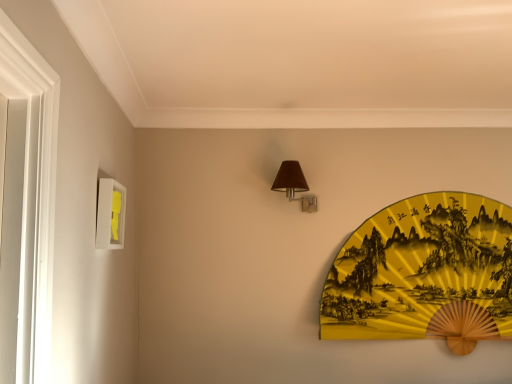
Where is `matte brown fabric at upper center`? This screenshot has height=384, width=512. matte brown fabric at upper center is located at coordinates (294, 185).

What are the coordinates of `yellow paper fan at upper right` in the screenshot? It's located at (421, 268).

Is matte brown fabric at upper center positioned before white matte picture frame at left?

No, the depth of matte brown fabric at upper center is greater than that of white matte picture frame at left.

Find the location of a particular element. The width and height of the screenshot is (512, 384). table lamp that appears on the right of white matte picture frame at left is located at coordinates (294, 185).

From a real-world perspective, which is physically above, matte brown fabric at upper center or white matte picture frame at left?

matte brown fabric at upper center is physically above.

From a real-world perspective, is matte brown fabric at upper center on yellow paper fan at upper right?

Yes, from a real-world perspective, matte brown fabric at upper center is above yellow paper fan at upper right.

Is matte brown fabric at upper center oriented towards yellow paper fan at upper right?

No, matte brown fabric at upper center is not facing towards yellow paper fan at upper right.

Which of these two, matte brown fabric at upper center or yellow paper fan at upper right, stands shorter?

matte brown fabric at upper center is shorter.

From the picture: Is white matte picture frame at left facing away from matte brown fabric at upper center?

No, white matte picture frame at left's orientation is not away from matte brown fabric at upper center.

Do you think white matte picture frame at left is within matte brown fabric at upper center, or outside of it?

white matte picture frame at left lies outside matte brown fabric at upper center.

Considering the relative sizes of white matte picture frame at left and matte brown fabric at upper center in the image provided, is white matte picture frame at left shorter than matte brown fabric at upper center?

No.

How far apart are white matte picture frame at left and matte brown fabric at upper center?

white matte picture frame at left is 90.76 centimeters away from matte brown fabric at upper center.

How much distance is there between yellow paper fan at upper right and matte brown fabric at upper center?

yellow paper fan at upper right and matte brown fabric at upper center are 64.29 centimeters apart.

From their relative heights in the image, would you say yellow paper fan at upper right is taller or shorter than matte brown fabric at upper center?

yellow paper fan at upper right is taller than matte brown fabric at upper center.

From the image's perspective, is yellow paper fan at upper right below matte brown fabric at upper center?

Indeed, from the image's perspective, yellow paper fan at upper right is shown beneath matte brown fabric at upper center.

Which object is further away from the camera taking this photo, yellow paper fan at upper right or matte brown fabric at upper center?

yellow paper fan at upper right is further from the camera.

Who is bigger, white matte picture frame at left or yellow paper fan at upper right?

With larger size is yellow paper fan at upper right.

Is point (113, 247) positioned behind point (396, 230)?

That is False.

From a real-world perspective, who is located lower, white matte picture frame at left or yellow paper fan at upper right?

yellow paper fan at upper right, from a real-world perspective.

This screenshot has width=512, height=384. Find the location of `design behind the white matte picture frame at left`. design behind the white matte picture frame at left is located at coordinates (421, 268).

Considering the positions of objects yellow paper fan at upper right and white matte picture frame at left in the image provided, who is more to the left, yellow paper fan at upper right or white matte picture frame at left?

Positioned to the left is white matte picture frame at left.

Considering the sizes of yellow paper fan at upper right and white matte picture frame at left in the image, is yellow paper fan at upper right wider or thinner than white matte picture frame at left?

In the image, yellow paper fan at upper right appears to be wider than white matte picture frame at left.

Is yellow paper fan at upper right placed right next to white matte picture frame at left?

No, yellow paper fan at upper right is not beside white matte picture frame at left.

Where is `table lamp that is above the white matte picture frame at left (from a real-world perspective)`? table lamp that is above the white matte picture frame at left (from a real-world perspective) is located at coordinates (294, 185).

Image resolution: width=512 pixels, height=384 pixels. I want to click on design located underneath the matte brown fabric at upper center (from a real-world perspective), so click(x=421, y=268).

When comparing their distances from white matte picture frame at left, does yellow paper fan at upper right or matte brown fabric at upper center seem closer?

The object closer to white matte picture frame at left is matte brown fabric at upper center.

Based on their spatial positions, is white matte picture frame at left or yellow paper fan at upper right closer to matte brown fabric at upper center?

yellow paper fan at upper right is positioned closer to the anchor matte brown fabric at upper center.

When comparing their distances from white matte picture frame at left, does matte brown fabric at upper center or yellow paper fan at upper right seem further?

yellow paper fan at upper right is further to white matte picture frame at left.

When comparing their distances from yellow paper fan at upper right, does white matte picture frame at left or matte brown fabric at upper center seem further?

white matte picture frame at left is further to yellow paper fan at upper right.

When comparing their distances from yellow paper fan at upper right, does matte brown fabric at upper center or white matte picture frame at left seem further?

Based on the image, white matte picture frame at left appears to be further to yellow paper fan at upper right.

From the picture: Estimate the real-world distances between objects in this image. Which object is further from matte brown fabric at upper center, yellow paper fan at upper right or white matte picture frame at left?

white matte picture frame at left is positioned further to the anchor matte brown fabric at upper center.

You are a GUI agent. You are given a task and a screenshot of the screen. Output one action in this format:
    pyautogui.click(x=<x>, y=<y>)
    Task: Click on the table lamp located between white matte picture frame at left and yellow paper fan at upper right in the left-right direction
    This screenshot has height=384, width=512.
    Given the screenshot: What is the action you would take?
    pyautogui.click(x=294, y=185)